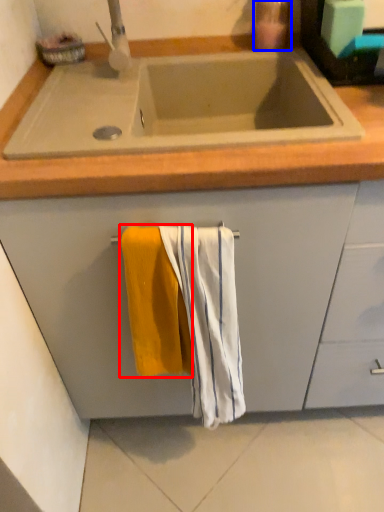
Question: Which object is closer to the camera taking this photo, beach towel (highlighted by a red box) or soap dispenser (highlighted by a blue box)?

Choices:
 (A) beach towel
 (B) soap dispenser

Answer: (A)